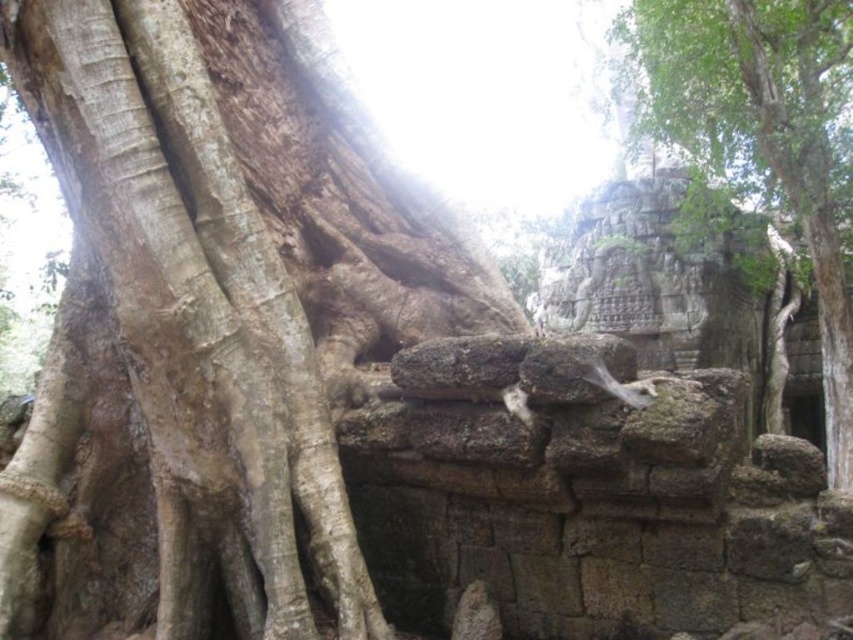
Question: Is smooth brown bark at center below green rough stone wall at upper right?

Choices:
 (A) no
 (B) yes

Answer: (B)

Question: Can you confirm if smooth brown bark at center is smaller than green rough stone wall at upper right?

Choices:
 (A) yes
 (B) no

Answer: (A)

Question: Observing the image, what is the correct spatial positioning of smooth brown bark at center in reference to green rough stone wall at upper right?

Choices:
 (A) above
 (B) below

Answer: (B)

Question: Which of the following is the closest to the observer?

Choices:
 (A) smooth brown bark at center
 (B) green rough stone wall at upper right

Answer: (A)

Question: Which point is closer to the camera taking this photo?

Choices:
 (A) (663, 12)
 (B) (190, 244)

Answer: (B)